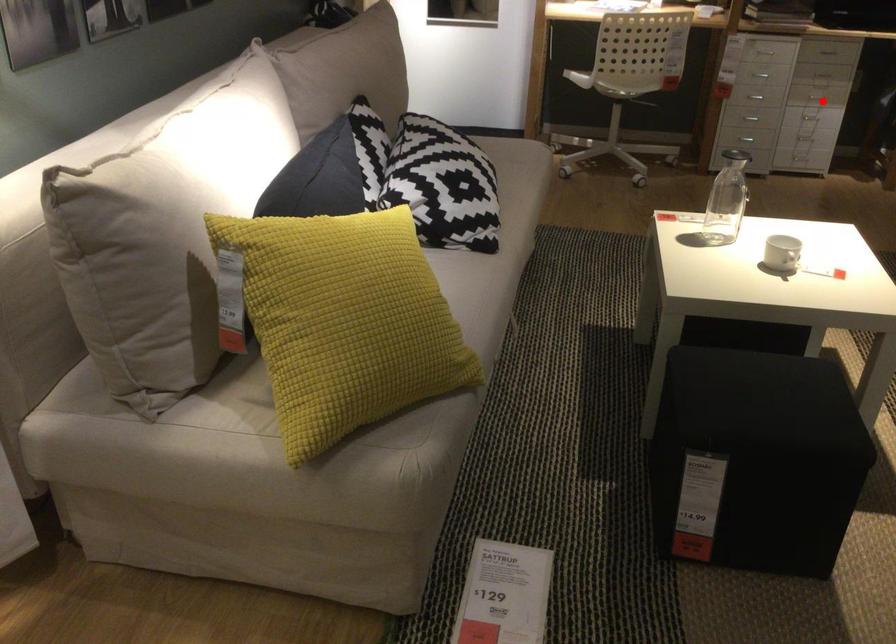
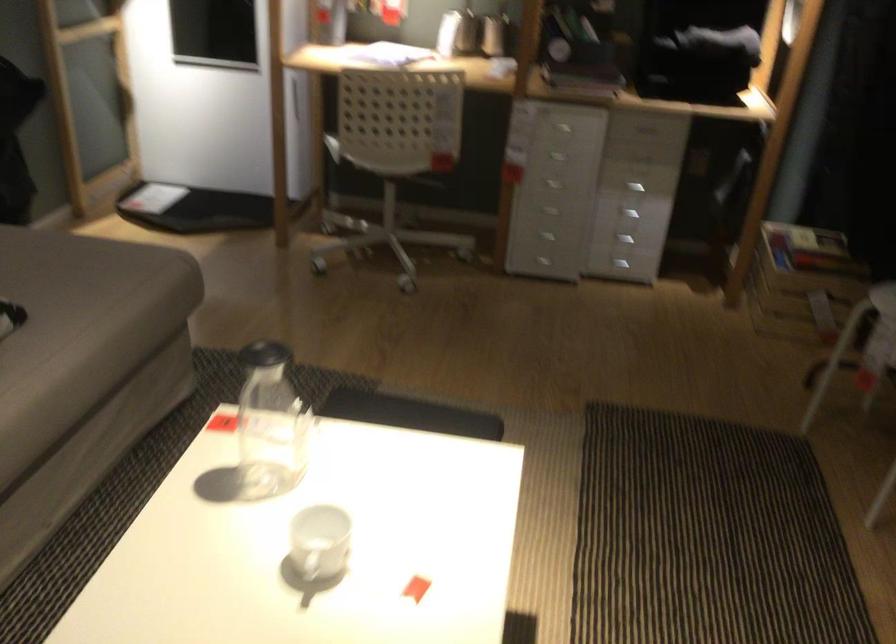
Locate, in the second image, the point that corresponds to the highlighted location in the first image.

(627, 214)